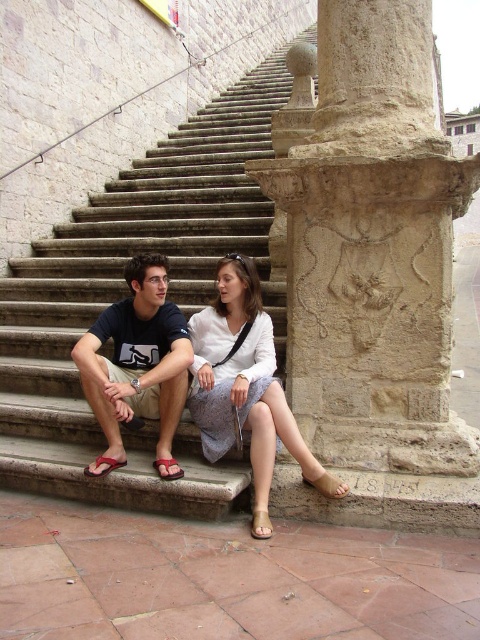
You are standing in front of the stone steps where the two people are sitting. You want to place a small flower pot between the two points labeled point (298, 308) and point (249, 376). Which point should the flower pot be closer to in order to be placed closer to you?

The flower pot should be closer to point (249, 376) because it is closer to you than point (298, 308).